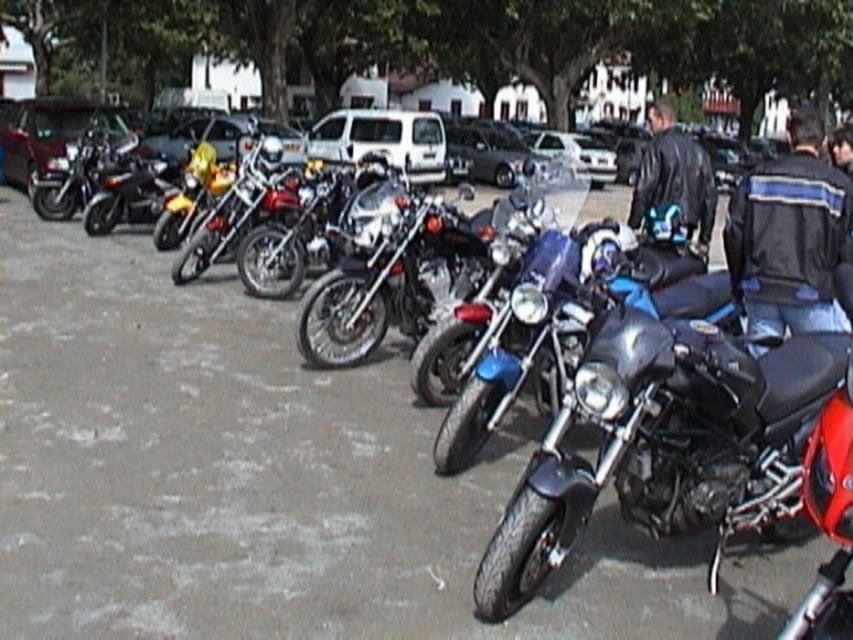
You are standing in the parking lot and want to reach a point that is exactly 20 feet away from you. Is the point at coordinates point [846,253] within this distance?

The distance of point [846,253] from viewer is 19.14 feet, so yes, the point at coordinates point [846,253] is within 20 feet distance.

You are standing in front of a row of motorcycles and want to take a photo. There are two points marked on the motorcycles at coordinates point (792,278) and point (492,172). Which point will appear closer to the camera in your photo?

Point (792,278) is closer to the camera than point (492,172), so it will appear closer in the photo.